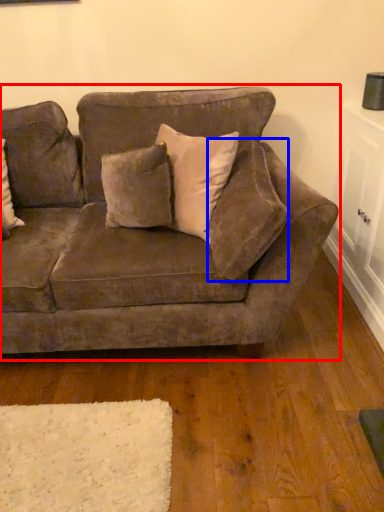
Question: Which object is closer to the camera taking this photo, studio couch (highlighted by a red box) or pillow (highlighted by a blue box)?

Choices:
 (A) studio couch
 (B) pillow

Answer: (B)